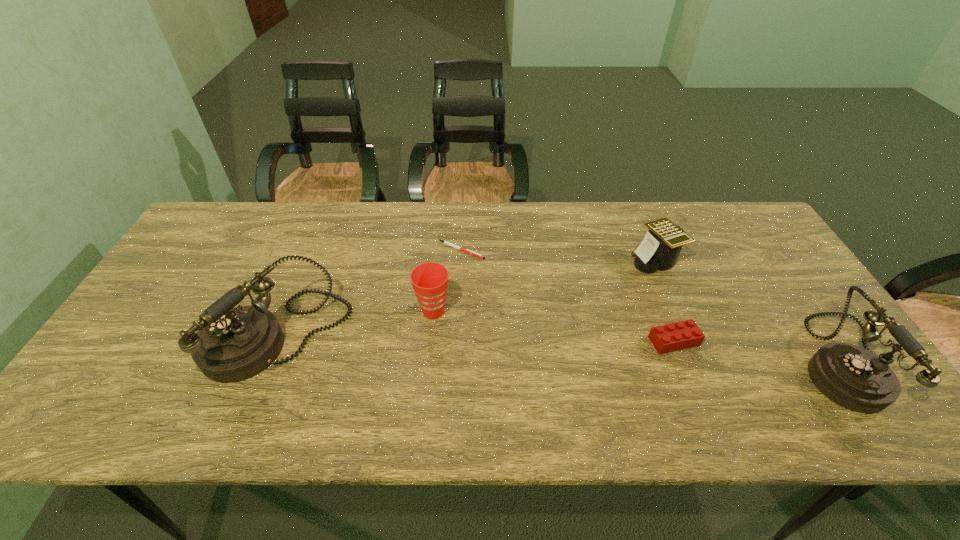
This screenshot has width=960, height=540. What are the coordinates of `the tallest object` in the screenshot? It's located at (232, 344).

Where is `the leftmost object`? The width and height of the screenshot is (960, 540). the leftmost object is located at coordinates coord(232,344).

Identify the location of the shorter telephone. (853, 377).

Find the location of a particular element. The image size is (960, 540). the rightmost object is located at coordinates (853, 377).

Find the location of a particular element. This screenshot has width=960, height=540. calculator is located at coordinates (659, 250).

This screenshot has height=540, width=960. What are the coordinates of `pen` in the screenshot? It's located at (445, 242).

This screenshot has height=540, width=960. In order to click on Lego in this screenshot , I will do `click(680, 335)`.

The image size is (960, 540). Find the location of `the fourth shortest object`. the fourth shortest object is located at coordinates (429, 280).

The width and height of the screenshot is (960, 540). Identify the location of vacant space situated 0.150m on the left of the taller telephone. (150, 338).

You are a GUI agent. You are given a task and a screenshot of the screen. Output one action in this format:
    pyautogui.click(x=<x>, y=<y>)
    Task: Click on the vacant space positioned on the back of the right telephone
    The width and height of the screenshot is (960, 540).
    Given the screenshot: What is the action you would take?
    click(754, 230)